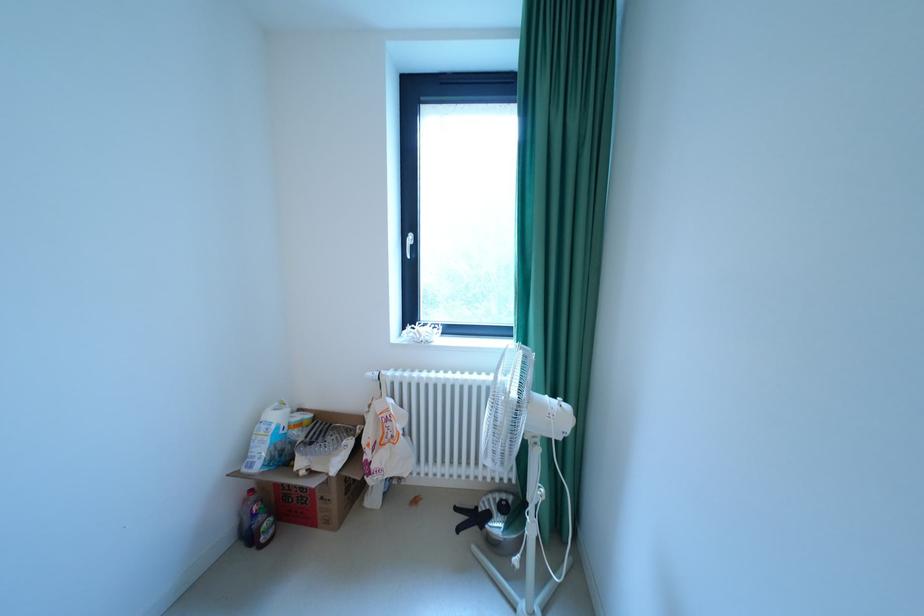
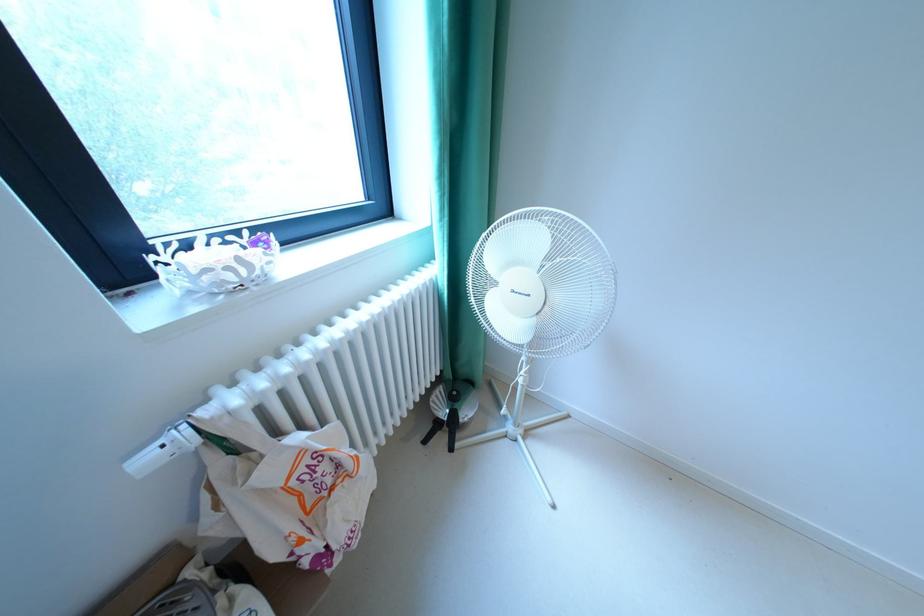
Find the pixel in the second image that matches point (380, 375) in the first image.

(156, 460)